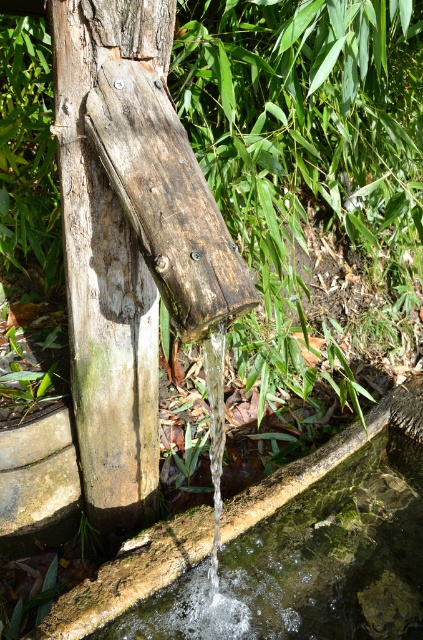
You are designing a miniature garden and need to place the weathered wood at center and the clear water at lower center. Given their sizes, which object should you allocate more space for in your design?

The weathered wood at center is larger in size than the clear water at lower center, so you should allocate more space for the weathered wood at center in your design.

You are standing in front of the water feature and want to place a small decorative rock. The rock needs to be placed to the right of the weathered wood at center. Will it end up to the left or right of the clear water at lower center?

The weathered wood at center is to the left of clear water at lower center. Placing the rock to the right of the weathered wood at center would position it to the right of the clear water at lower center.

You are standing in front of the rustic wooden water feature. You want to touch both the weathered wood at center and the clear water at lower center. Which object should you reach for first to touch the one closer to you?

The weathered wood at center is in front of clear water at lower center, so you should reach for the weathered wood at center first since it is closer to you.